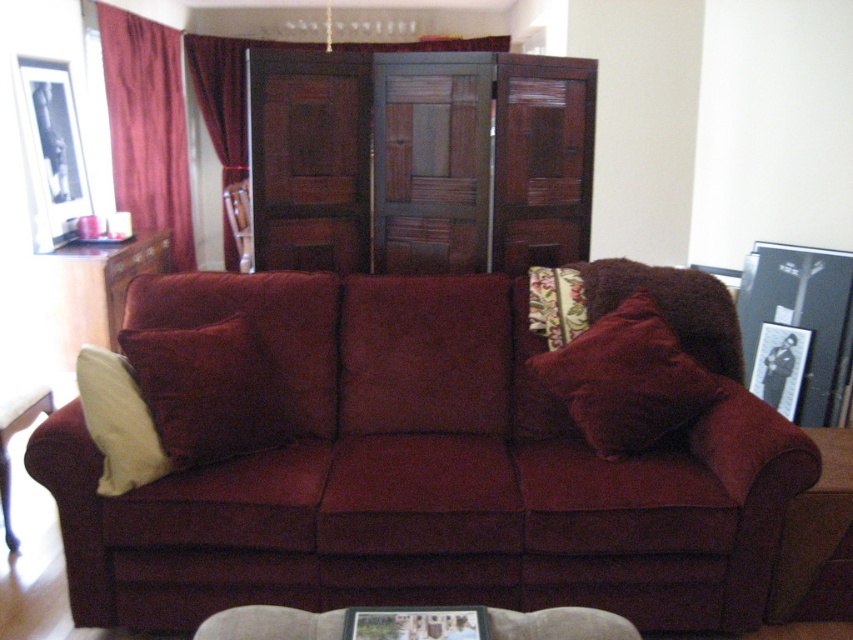
Question: Does black matte picture frame at upper left have a larger size compared to velvet curtain at center?

Choices:
 (A) no
 (B) yes

Answer: (A)

Question: Does velvet maroon couch at center have a lesser width compared to metallic silver picture frame at center?

Choices:
 (A) yes
 (B) no

Answer: (B)

Question: Can you confirm if burgundy velvet curtain at left is bigger than soft yellow pillow at left?

Choices:
 (A) no
 (B) yes

Answer: (B)

Question: Which object is positioned farthest from the black paper picture frame at right?

Choices:
 (A) velvet curtain at center
 (B) black matte picture frame at upper left
 (C) burgundy velvet curtain at left
 (D) velvet yellow pillow at left

Answer: (A)

Question: Which point is closer to the camera?

Choices:
 (A) (325, 355)
 (B) (798, 348)
 (C) (10, 552)
 (D) (656, 305)

Answer: (D)

Question: Among these points, which one is farthest from the camera?

Choices:
 (A) (154, 406)
 (B) (18, 88)
 (C) (798, 376)

Answer: (B)